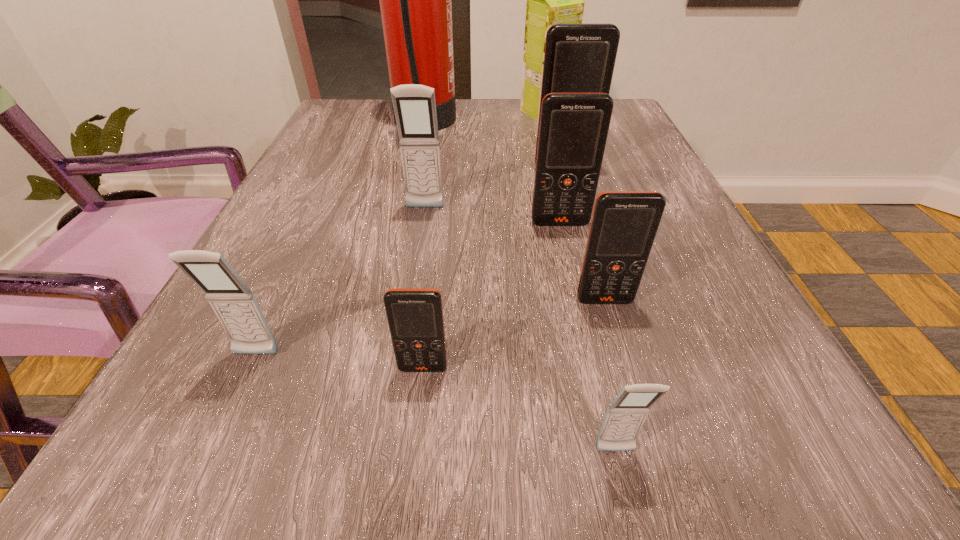
Where is `free space located on the front-facing side of the biggest gray cellular telephone`? The width and height of the screenshot is (960, 540). free space located on the front-facing side of the biggest gray cellular telephone is located at coordinates (417, 260).

Locate an element on the screen. This screenshot has height=540, width=960. vacant position located on the screen of the fifth nearest object is located at coordinates (575, 289).

Where is `vacant point located on the front-facing side of the third nearest cellular telephone`? The height and width of the screenshot is (540, 960). vacant point located on the front-facing side of the third nearest cellular telephone is located at coordinates (187, 507).

Identify the location of vacant space located 0.230m on the screen of the fourth nearest cellular telephone. Image resolution: width=960 pixels, height=540 pixels. (652, 468).

This screenshot has width=960, height=540. I want to click on free spot located on the screen of the nearest orange cellular telephone, so click(x=417, y=427).

The image size is (960, 540). I want to click on fire extinguisher that is positioned at the far edge, so click(x=415, y=0).

Find the location of a particular element. This screenshot has width=960, height=540. soya milk positioned at the far edge is located at coordinates (x=551, y=0).

I want to click on object that is at the near edge, so click(x=625, y=416).

The image size is (960, 540). I want to click on fire extinguisher situated at the left edge, so click(x=415, y=0).

Locate an element on the screen. cellular telephone located at the left edge is located at coordinates (236, 307).